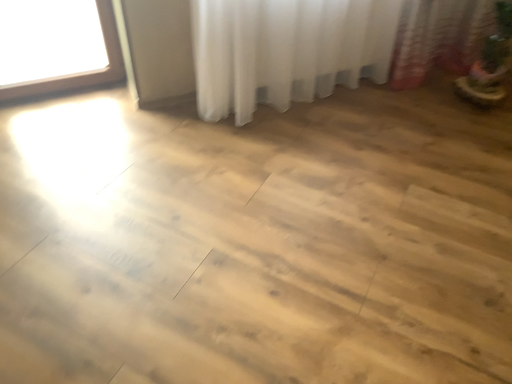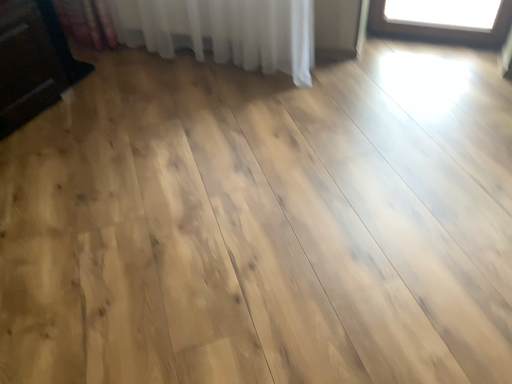
Question: Which way did the camera rotate in the video?

Choices:
 (A) rotated downward
 (B) rotated upward

Answer: (B)